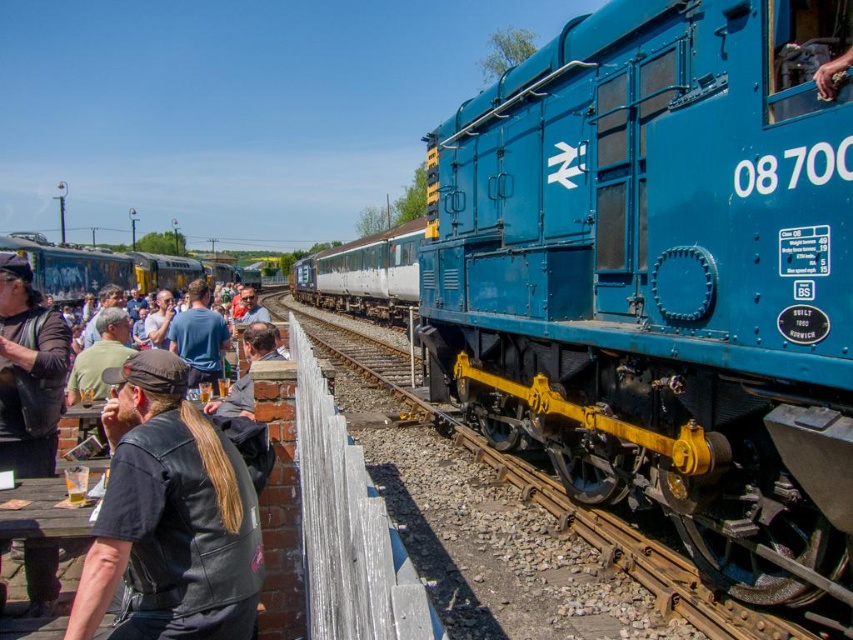
You are a photographer standing at the railway station. You want to take a photo of the blue metallic train at center without including the black leather jacket at lower left in the frame. Is it possible to adjust your position to achieve this?

The blue metallic train at center is positioned over the black leather jacket at lower left, so moving your position to an angle where the train is framed without the jacket might be possible by positioning yourself so the train obscures the jacket from view.

You are a photographer standing at the railway station. You want to take a photo of both the blue metallic train at center and the blue cotton shirt at center. Based on their positions, which object should you focus on first to ensure both are in frame?

The blue metallic train at center is positioned on the right side of blue cotton shirt at center, so you should focus on the blue cotton shirt at center first to ensure both are in frame.

You are standing on the platform and want to board the blue metallic train at center. Which direction should you walk from the black leather jacket at lower left to reach it?

You should walk to the right from the black leather jacket at lower left to reach the blue metallic train at center because the blue metallic train at center is located to the right of the black leather jacket at lower left.